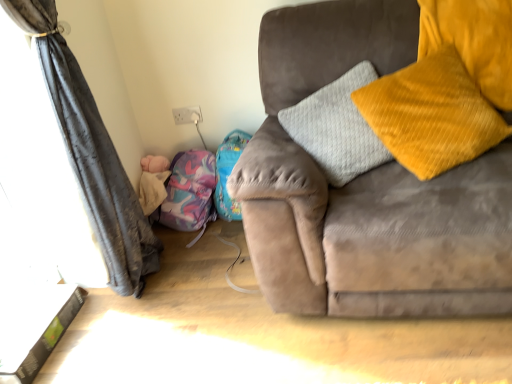
Describe the element at coordinates (153, 182) in the screenshot. I see `soft pink plush at lower left` at that location.

I want to click on soft pink plush at lower left, so click(x=153, y=182).

Which object is further away from the camera, white glossy table at lower left or purple fabric bean bag chair at lower left?

purple fabric bean bag chair at lower left is more distant.

At what (x,y) coordinates should I click in order to perform the action: click on table below the purple fabric bean bag chair at lower left (from the image's perspective). Please return your answer as a coordinate pair (x, y). The width and height of the screenshot is (512, 384). Looking at the image, I should click on (33, 327).

From the image's perspective, would you say white glossy table at lower left is positioned over purple fabric bean bag chair at lower left?

No, from the image's perspective, white glossy table at lower left is not on top of purple fabric bean bag chair at lower left.

Is there a large distance between white glossy table at lower left and purple fabric bean bag chair at lower left?

Actually, white glossy table at lower left and purple fabric bean bag chair at lower left are a little close together.

Which of these two, white glossy table at lower left or soft pink plush at lower left, stands shorter?

white glossy table at lower left.

Considering their positions, is white glossy table at lower left located in front of or behind soft pink plush at lower left?

white glossy table at lower left is positioned closer to the viewer than soft pink plush at lower left.

Could soft pink plush at lower left be considered to be inside white glossy table at lower left?

Actually, soft pink plush at lower left is outside white glossy table at lower left.

Does white glossy table at lower left have a lesser width compared to soft pink plush at lower left?

In fact, white glossy table at lower left might be wider than soft pink plush at lower left.

Based on the photo, considering the relative positions of white glossy table at lower left and velvet yellow pillow at right in the image provided, is white glossy table at lower left to the left or to the right of velvet yellow pillow at right?

In the image, white glossy table at lower left appears on the left side of velvet yellow pillow at right.

Does white glossy table at lower left have a greater height compared to velvet yellow pillow at right?

In fact, white glossy table at lower left may be shorter than velvet yellow pillow at right.

How much distance is there between white glossy table at lower left and velvet yellow pillow at right?

white glossy table at lower left and velvet yellow pillow at right are 4.90 feet apart from each other.

Does point (159, 201) appear closer or farther from the camera than point (136, 221)?

Point (159, 201) is positioned farther from the camera compared to point (136, 221).

From the image's perspective, is soft pink plush at lower left under dark grey fabric curtain at left?

→ No, from the image's perspective, soft pink plush at lower left is not below dark grey fabric curtain at left.

Which object is further away from the camera taking this photo, soft pink plush at lower left or dark grey fabric curtain at left?

soft pink plush at lower left is more distant.

From a real-world perspective, is soft pink plush at lower left positioned above or below dark grey fabric curtain at left?

In terms of real-world spatial position, soft pink plush at lower left is below dark grey fabric curtain at left.

Is soft pink plush at lower left positioned beyond the bounds of purple fabric bean bag chair at lower left?

Yes, soft pink plush at lower left is outside of purple fabric bean bag chair at lower left.

From a real-world perspective, which object stands above the other?

From a 3D spatial view, soft pink plush at lower left is above.

Who is smaller, soft pink plush at lower left or purple fabric bean bag chair at lower left?

soft pink plush at lower left.

Which object is positioned more to the right, dark grey fabric curtain at left or purple fabric bean bag chair at lower left?

purple fabric bean bag chair at lower left is more to the right.

Which is closer to the camera, (62, 100) or (175, 217)?

Clearly, point (62, 100) is closer to the camera than point (175, 217).

Does dark grey fabric curtain at left have a smaller size compared to purple fabric bean bag chair at lower left?

Actually, dark grey fabric curtain at left might be larger than purple fabric bean bag chair at lower left.

Does dark grey fabric curtain at left touch purple fabric bean bag chair at lower left?

No, dark grey fabric curtain at left is not touching purple fabric bean bag chair at lower left.

Is white glossy table at lower left inside the boundaries of suede gray couch at right, or outside?

white glossy table at lower left exists outside the volume of suede gray couch at right.

From a real-world perspective, between white glossy table at lower left and suede gray couch at right, who is vertically lower?

white glossy table at lower left is physically lower.

Considering the positions of objects white glossy table at lower left and suede gray couch at right in the image provided, who is behind, white glossy table at lower left or suede gray couch at right?

white glossy table at lower left is further from the camera.

Find the location of a particular element. bean bag chair behind the white glossy table at lower left is located at coordinates (188, 191).

Locate an element on the screen. table below the soft pink plush at lower left (from the image's perspective) is located at coordinates (33, 327).

Based on their spatial positions, is soft pink plush at lower left or white glossy table at lower left closer to velvet yellow pillow at right?

soft pink plush at lower left is positioned closer to the anchor velvet yellow pillow at right.

In the scene shown: Considering their positions, is purple fabric bean bag chair at lower left positioned further to soft pink plush at lower left than suede gray couch at right?

Based on the image, suede gray couch at right appears to be further to soft pink plush at lower left.

Consider the image. Considering their positions, is dark grey fabric curtain at left positioned further to purple fabric bean bag chair at lower left than soft pink plush at lower left?

The object further to purple fabric bean bag chair at lower left is dark grey fabric curtain at left.

Estimate the real-world distances between objects in this image. Which object is further from dark grey fabric curtain at left, white glossy table at lower left or soft pink plush at lower left?

Based on the image, soft pink plush at lower left appears to be further to dark grey fabric curtain at left.

Estimate the real-world distances between objects in this image. Which object is closer to velvet yellow pillow at right, soft pink plush at lower left or purple fabric bean bag chair at lower left?

purple fabric bean bag chair at lower left lies closer to velvet yellow pillow at right than the other object.

Estimate the real-world distances between objects in this image. Which object is closer to dark grey fabric curtain at left, velvet yellow pillow at right or white glossy table at lower left?

white glossy table at lower left is positioned closer to the anchor dark grey fabric curtain at left.

Looking at the image, which one is located further to suede gray couch at right, velvet yellow pillow at right or purple fabric bean bag chair at lower left?

purple fabric bean bag chair at lower left.

Based on their spatial positions, is white glossy table at lower left or soft pink plush at lower left closer to suede gray couch at right?

white glossy table at lower left lies closer to suede gray couch at right than the other object.

Identify the location of studio couch situated between soft pink plush at lower left and velvet yellow pillow at right from left to right. The width and height of the screenshot is (512, 384). (366, 189).

Find the location of `throw pillow between suede gray couch at right and purple fabric bean bag chair at lower left from front to back`. throw pillow between suede gray couch at right and purple fabric bean bag chair at lower left from front to back is located at coordinates (431, 114).

What are the coordinates of `baby between white glossy table at lower left and velvet yellow pillow at right in the horizontal direction` in the screenshot? It's located at (153, 182).

Locate an element on the screen. The image size is (512, 384). bean bag chair situated between white glossy table at lower left and velvet yellow pillow at right from left to right is located at coordinates (188, 191).